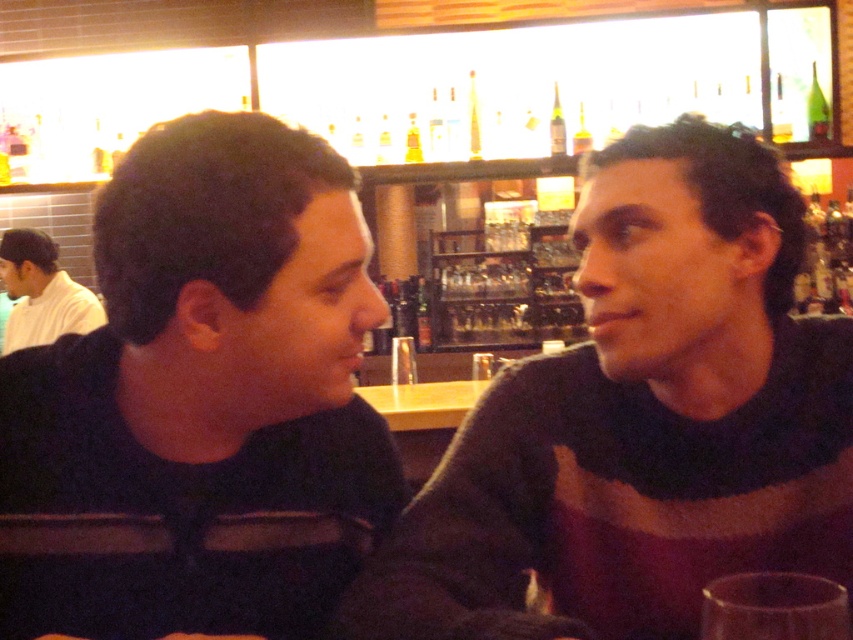
You are a delivery robot positioned at the point with coordinates point (160, 582). You need to deliver a package to the point with coordinates point (825, 120). According to the image, which direction should you move to reach your destination?

Since point (160, 582) is in front of point (825, 120), you should move backward to reach the destination point (825, 120).

You are a bartender preparing to place a green glass bottle at upper right on the shelf. The dark blue sweater at left is in the way. Can you move the bottle to the shelf without moving the sweater?

The dark blue sweater at left is located below the green glass bottle at upper right, so the bottle is already positioned above the sweater. Therefore, you can place the bottle on the shelf without moving the sweater since it is already above it.